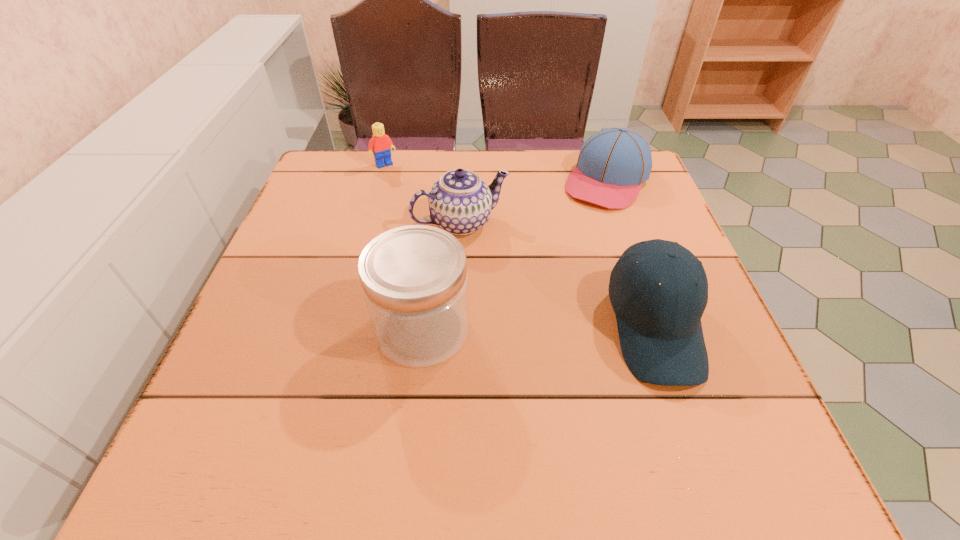
At what (x,y) coordinates should I click in order to perform the action: click on object that is at the far left corner. Please return your answer as a coordinate pair (x, y). The height and width of the screenshot is (540, 960). Looking at the image, I should click on [381, 143].

Find the location of a particular element. The image size is (960, 540). object located at the far right corner is located at coordinates (612, 165).

This screenshot has width=960, height=540. I want to click on object that is at the near right corner, so click(x=659, y=326).

This screenshot has height=540, width=960. What are the coordinates of `free location at the far edge` in the screenshot? It's located at (525, 178).

Locate an element on the screen. The width and height of the screenshot is (960, 540). free space at the near edge is located at coordinates (379, 386).

In the image, there is a desktop. Identify the location of free space at the left edge. This screenshot has height=540, width=960. coord(341,272).

Where is `vacant region at the right edge`? The height and width of the screenshot is (540, 960). vacant region at the right edge is located at coordinates (632, 227).

Locate an element on the screen. vacant area at the far left corner of the desktop is located at coordinates (369, 186).

In order to click on vacant area at the near left corner of the desktop in this screenshot , I will do `click(253, 402)`.

This screenshot has height=540, width=960. Identify the location of free space between the chinaware and the taller baseball cap. (558, 276).